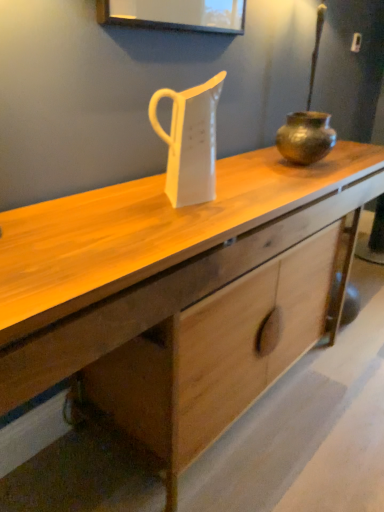
Locate an element on the screen. The width and height of the screenshot is (384, 512). vacant region to the left of white glossy jug at center is located at coordinates (119, 200).